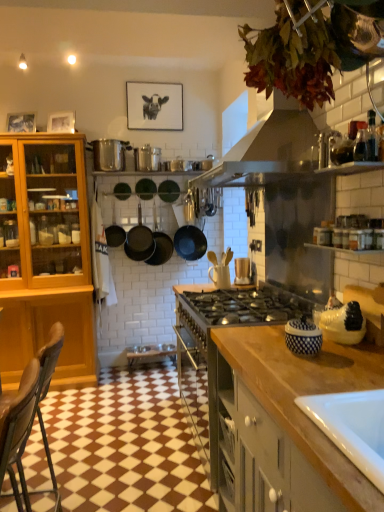
What is the approximate height of matte wooden picture frame at upper left, positioned as the second picture frame in right-to-left order?

The height of matte wooden picture frame at upper left, positioned as the second picture frame in right-to-left order, is 9.19 inches.

At what (x,y) coordinates should I click in order to perform the action: click on brown leather chair at lower left. Please return your answer as a coordinate pair (x, y). The height and width of the screenshot is (512, 384). Looking at the image, I should click on (50, 357).

What do you see at coordinates (302, 395) in the screenshot? The image size is (384, 512). I see `wooden at right` at bounding box center [302, 395].

Describe the element at coordinates (145, 189) in the screenshot. This screenshot has width=384, height=512. I see `black matte frying pan at center, arranged as the first frying pan when viewed from the left` at that location.

Identify the location of matte white ceramic jar at right, positioned as the 1th appliance in right-to-left order. (343, 324).

Looking at the image, does black matte frying pan at center, the third kitchen appliance positioned from the right, seem bigger or smaller compared to matte brown wooden spoon holder at center, which appears as the 3th appliance when viewed from the left?

In the image, black matte frying pan at center, the third kitchen appliance positioned from the right, appears to be larger than matte brown wooden spoon holder at center, which appears as the 3th appliance when viewed from the left.

From a real-world perspective, starting from the black matte frying pan at center, the third kitchen appliance positioned from the right, which appliance is the 1st one below it? Please provide its 2D coordinates.

[(243, 271)]

Considering the relative sizes of black matte frying pan at center, the third kitchen appliance positioned from the right, and matte brown wooden spoon holder at center, marked as the 3th appliance in a bottom-to-top arrangement, in the image provided, is black matte frying pan at center, the third kitchen appliance positioned from the right, thinner than matte brown wooden spoon holder at center, marked as the 3th appliance in a bottom-to-top arrangement,?

Incorrect, the width of black matte frying pan at center, the third kitchen appliance positioned from the right, is not less than that of matte brown wooden spoon holder at center, marked as the 3th appliance in a bottom-to-top arrangement.

Between black matte frying pan at center, the third kitchen appliance positioned from the right, and matte brown wooden spoon holder at center, the 3th appliance when ordered from top to bottom, which one is positioned behind?

black matte frying pan at center, the third kitchen appliance positioned from the right, is more distant.

Considering the positions of point (243, 270) and point (167, 186), is point (243, 270) closer or farther from the camera than point (167, 186)?

Point (243, 270) appears to be closer to the viewer than point (167, 186).

From a real-world perspective, between matte brown wooden spoon holder at center, marked as the 3th appliance in a bottom-to-top arrangement, and black matte frying pan at center, which is the 1th frying pan from right to left, who is vertically lower?

matte brown wooden spoon holder at center, marked as the 3th appliance in a bottom-to-top arrangement, from a real-world perspective.

Who is more distant, matte brown wooden spoon holder at center, placed as the third appliance when sorted from back to front, or black matte frying pan at center, which is the 1th frying pan from right to left?

black matte frying pan at center, which is the 1th frying pan from right to left, is more distant.

Considering the sizes of matte brown wooden spoon holder at center, which appears as the 3th appliance when viewed from the left, and black matte frying pan at center, the second frying pan positioned from the left, in the image, is matte brown wooden spoon holder at center, which appears as the 3th appliance when viewed from the left, bigger or smaller than black matte frying pan at center, the second frying pan positioned from the left,?

In the image, matte brown wooden spoon holder at center, which appears as the 3th appliance when viewed from the left, appears to be larger than black matte frying pan at center, the second frying pan positioned from the left.

Is blue and white ceramic jar at right, which appears as the fifth appliance when viewed from the top, behind matte white ceramic jar at right, the 5th appliance positioned from the left?

No, the depth of blue and white ceramic jar at right, which appears as the fifth appliance when viewed from the top, is less than that of matte white ceramic jar at right, the 5th appliance positioned from the left.

Considering the sizes of blue and white ceramic jar at right, which appears as the 1th appliance when ordered from the bottom, and matte white ceramic jar at right, which appears as the second appliance when viewed from the front, in the image, is blue and white ceramic jar at right, which appears as the 1th appliance when ordered from the bottom, bigger or smaller than matte white ceramic jar at right, which appears as the second appliance when viewed from the front,?

Clearly, blue and white ceramic jar at right, which appears as the 1th appliance when ordered from the bottom, is smaller in size than matte white ceramic jar at right, which appears as the second appliance when viewed from the front.

Does blue and white ceramic jar at right, which appears as the 1th appliance when ordered from the bottom, have a lesser height compared to matte white ceramic jar at right, the 4th appliance in the back-to-front sequence?

Correct, blue and white ceramic jar at right, which appears as the 1th appliance when ordered from the bottom, is not as tall as matte white ceramic jar at right, the 4th appliance in the back-to-front sequence.

Could you tell me if blue and white ceramic jar at right, which appears as the 5th appliance when viewed from the back, is turned towards matte white ceramic jar at right, which appears as the second appliance when viewed from the front?

No, blue and white ceramic jar at right, which appears as the 5th appliance when viewed from the back, does not turn towards matte white ceramic jar at right, which appears as the second appliance when viewed from the front.

Consider the image. Is matte brown wooden spoon holder at center, which is counted as the third appliance, starting from the front, positioned before blue and white ceramic jar at right, positioned as the 1th appliance in front-to-back order?

No, it is not.

In terms of width, does matte brown wooden spoon holder at center, which is counted as the third appliance, starting from the front, look wider or thinner when compared to blue and white ceramic jar at right, which appears as the fifth appliance when viewed from the top?

In the image, matte brown wooden spoon holder at center, which is counted as the third appliance, starting from the front, appears to be more narrow than blue and white ceramic jar at right, which appears as the fifth appliance when viewed from the top.

Is matte brown wooden spoon holder at center, which is the third appliance from right to left, directly adjacent to blue and white ceramic jar at right, positioned as the 1th appliance in front-to-back order?

matte brown wooden spoon holder at center, which is the third appliance from right to left, and blue and white ceramic jar at right, positioned as the 1th appliance in front-to-back order, are not in contact.

Is point (247, 282) positioned in front of point (307, 325)?

No, (247, 282) is behind (307, 325).

Between shiny metallic pot at center, which ranks as the 5th appliance in front-to-back order, and brown leather chair at lower left, which one has larger size?

brown leather chair at lower left.

Is shiny metallic pot at center, the 4th appliance viewed from the right, shorter than brown leather chair at lower left?

Correct, shiny metallic pot at center, the 4th appliance viewed from the right, is not as tall as brown leather chair at lower left.

Does shiny metallic pot at center, the second appliance from the top, appear on the left side of brown leather chair at lower left?

Incorrect, shiny metallic pot at center, the second appliance from the top, is not on the left side of brown leather chair at lower left.

Is shiny metallic pot at center, marked as the fourth appliance in a bottom-to-top arrangement, oriented away from brown leather chair at lower left?

No, shiny metallic pot at center, marked as the fourth appliance in a bottom-to-top arrangement, is not facing the opposite direction of brown leather chair at lower left.

Consider the image. Is wooden at right inside the boundaries of brown leather chair at lower left, or outside?

wooden at right lies outside brown leather chair at lower left.

Based on the photo, from a real-world perspective, is wooden at right positioned above or below brown leather chair at lower left?

wooden at right is situated lower than brown leather chair at lower left in the real world.

Does wooden at right have a greater height compared to brown leather chair at lower left?

No.

From the image's perspective, is wooden at right beneath brown leather chair at lower left?

Correct, wooden at right appears lower than brown leather chair at lower left in the image.

From a real-world perspective, is brown leather chair at lower left positioned above or below blue and white ceramic jar at right, arranged as the 4th appliance when viewed from the left?

From a real-world perspective, brown leather chair at lower left is physically below blue and white ceramic jar at right, arranged as the 4th appliance when viewed from the left.

Can you confirm if brown leather chair at lower left is wider than blue and white ceramic jar at right, which appears as the fifth appliance when viewed from the top?

Yes.

The width and height of the screenshot is (384, 512). I want to click on the 2nd appliance to the right of the black matte frying pan at center, the third kitchen appliance positioned from the right, starting your count from the anchor, so click(243, 271).

From the image's perspective, which appliance is the 1st one below the black matte frying pan at center, the second frying pan positioned from the left? Please provide its 2D coordinates.

[(243, 271)]

Estimate the real-world distances between objects in this image. Which object is closer to black matte pan at center, which is the 3th kitchen appliance from left to right, matte brown wooden spoon holder at center, the 3th appliance when ordered from top to bottom, or matte white ceramic jar at right, the 5th appliance positioned from the left?

The object closer to black matte pan at center, which is the 3th kitchen appliance from left to right, is matte brown wooden spoon holder at center, the 3th appliance when ordered from top to bottom.

Which object lies nearer to the anchor point brown leather chair at lower left, metallic silver pot at upper center, placed as the first appliance when sorted from left to right, or black matte picture frame at upper center, the 2th picture frame positioned from the front?

Among the two, metallic silver pot at upper center, placed as the first appliance when sorted from left to right, is located nearer to brown leather chair at lower left.

Looking at the image, which one is located closer to black matte picture frame at upper center, the second picture frame in the left-to-right sequence, black matte frying pan at center, which is counted as the first kitchen appliance, starting from the left, or black matte frying pan at center, which is the 1th frying pan from right to left?

Among the two, black matte frying pan at center, which is the 1th frying pan from right to left, is located nearer to black matte picture frame at upper center, the second picture frame in the left-to-right sequence.

Considering their positions, is shiny metallic pot at center, the second appliance positioned from the left, positioned further to brown leather chair at lower left than black matte frying pan at center, which is the 1th frying pan from right to left?

Among the two, shiny metallic pot at center, the second appliance positioned from the left, is located further to brown leather chair at lower left.

From the image, which object appears to be farther from black matte picture frame at upper center, the 2th picture frame positioned from the front, brown leather chair at lower left or shiny metallic pot at center, the second appliance positioned from the left?

The object further to black matte picture frame at upper center, the 2th picture frame positioned from the front, is brown leather chair at lower left.

Looking at this image, from the image, which object appears to be farther from blue and white ceramic jar at right, which appears as the fifth appliance when viewed from the top, matte white ceramic jar at right, positioned as the 1th appliance in right-to-left order, or brown leather chair at lower left?

Among the two, brown leather chair at lower left is located further to blue and white ceramic jar at right, which appears as the fifth appliance when viewed from the top.

Considering their positions, is blue and white ceramic jar at right, which appears as the fifth appliance when viewed from the top, positioned closer to matte brown wooden spoon holder at center, placed as the third appliance when sorted from back to front, than brown leather chair at lower left?

Among the two, blue and white ceramic jar at right, which appears as the fifth appliance when viewed from the top, is located nearer to matte brown wooden spoon holder at center, placed as the third appliance when sorted from back to front.

Based on their spatial positions, is blue and white ceramic jar at right, which appears as the fifth appliance when viewed from the top, or shiny metallic pot at center, marked as the first appliance in a back-to-front arrangement, closer to black matte pan at center, which is the 3th kitchen appliance from left to right?

shiny metallic pot at center, marked as the first appliance in a back-to-front arrangement, is positioned closer to the anchor black matte pan at center, which is the 3th kitchen appliance from left to right.

This screenshot has width=384, height=512. What are the coordinates of `appliance between metallic silver pot at upper center, the second appliance from the back, and black matte frying pan at center, the second frying pan positioned from the left, in the horizontal direction` in the screenshot? It's located at (147, 158).

This screenshot has width=384, height=512. I want to click on frying pan situated between matte wooden picture frame at upper left, which is the 2th picture frame in back-to-front order, and black matte picture frame at upper center, the 2th picture frame positioned from the front, from left to right, so click(x=145, y=189).

Image resolution: width=384 pixels, height=512 pixels. In order to click on picture frame between wooden at right and matte black pans at center, the second kitchen appliance from the left, in the front-back direction in this screenshot , I will do `click(21, 122)`.

This screenshot has height=512, width=384. I want to click on appliance located between wooden at right and matte white ceramic jar at right, which appears as the second appliance when viewed from the front, in the depth direction, so [303, 337].